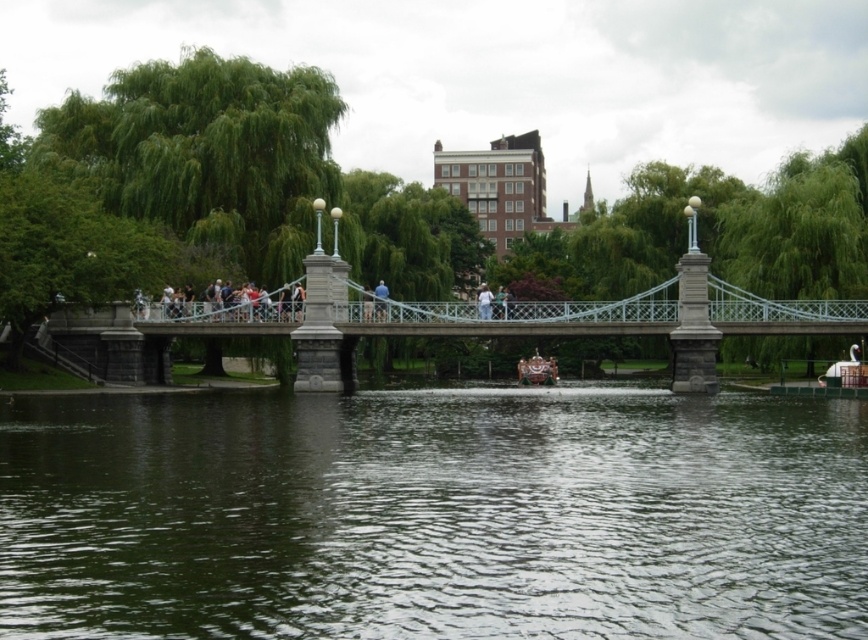
Does greenish water at center appear over white cotton shirt at center?

Actually, greenish water at center is below white cotton shirt at center.

From the picture: Who is higher up, greenish water at center or white cotton shirt at center?

white cotton shirt at center is above.

Where is `greenish water at center`? greenish water at center is located at coordinates 434,515.

From the picture: Can you confirm if metallic gray bridge at center is positioned to the left of light blue jeans at center?

In fact, metallic gray bridge at center is to the right of light blue jeans at center.

Is point (340, 388) less distant than point (383, 310)?

That is True.

Image resolution: width=868 pixels, height=640 pixels. Identify the location of metallic gray bridge at center. (500, 316).

Identify the location of metallic gray bridge at center. (500, 316).

Is green leafy tree at upper center taller than light blue jeans at center?

Yes, green leafy tree at upper center is taller than light blue jeans at center.

Does point (796, 177) come closer to viewer compared to point (376, 285)?

No, (796, 177) is further to viewer.

Locate an element on the screen. This screenshot has height=640, width=868. green leafy tree at upper center is located at coordinates (419, 196).